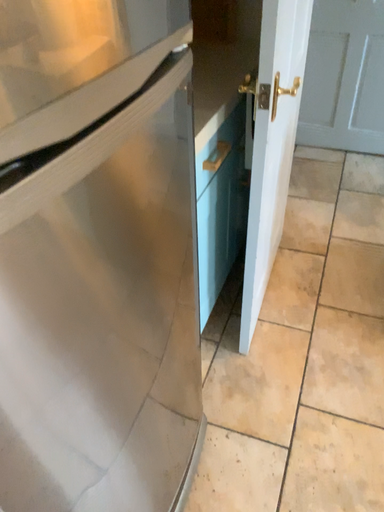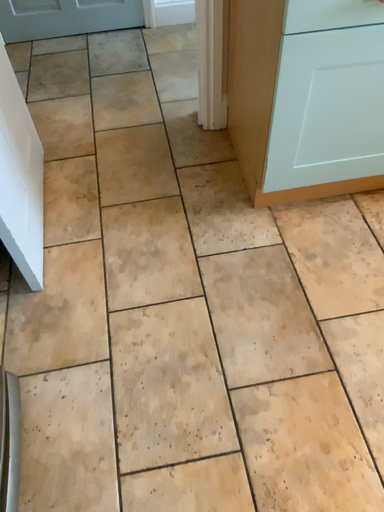
Question: Which way did the camera rotate in the video?

Choices:
 (A) rotated right
 (B) rotated left

Answer: (A)